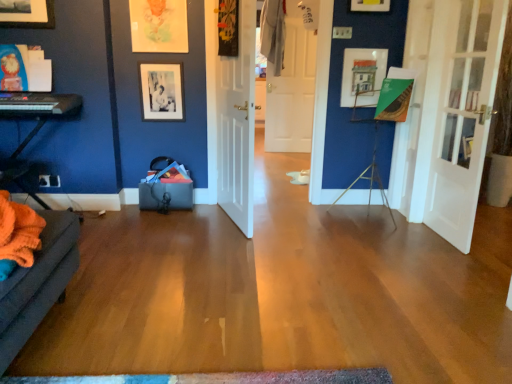
Question: Is white wooden door at center, the third door positioned from the right, next to black matte picture frame at upper center, which is counted as the third picture frame, starting from the right?

Choices:
 (A) yes
 (B) no

Answer: (B)

Question: Considering the relative sizes of white wooden door at center, positioned as the second door in back-to-front order, and black matte picture frame at upper center, marked as the first picture frame in a left-to-right arrangement, in the image provided, is white wooden door at center, positioned as the second door in back-to-front order, wider than black matte picture frame at upper center, marked as the first picture frame in a left-to-right arrangement,?

Choices:
 (A) no
 (B) yes

Answer: (B)

Question: Can you confirm if white wooden door at center, the third door positioned from the right, is bigger than black matte picture frame at upper center, which is counted as the third picture frame, starting from the right?

Choices:
 (A) yes
 (B) no

Answer: (A)

Question: From the image's perspective, is white wooden door at center, the third door positioned from the right, above black matte picture frame at upper center, which is counted as the third picture frame, starting from the right?

Choices:
 (A) yes
 (B) no

Answer: (B)

Question: Is white wooden door at center, the third door positioned from the right, closer to the viewer compared to black matte picture frame at upper center, which is counted as the third picture frame, starting from the right?

Choices:
 (A) no
 (B) yes

Answer: (B)

Question: Would you say black matte picture frame at upper center, which is counted as the third picture frame, starting from the right, is part of white wooden door at center, the third door positioned from the right,'s contents?

Choices:
 (A) no
 (B) yes

Answer: (A)

Question: Is the position of black matte keyboard at left more distant than that of matte wooden picture frame at upper center, marked as the first picture frame in a right-to-left arrangement?

Choices:
 (A) yes
 (B) no

Answer: (B)

Question: Is black matte keyboard at left bigger than matte wooden picture frame at upper center, acting as the third picture frame starting from the left?

Choices:
 (A) yes
 (B) no

Answer: (A)

Question: Is black matte keyboard at left not near matte wooden picture frame at upper center, marked as the first picture frame in a right-to-left arrangement?

Choices:
 (A) yes
 (B) no

Answer: (A)

Question: From a real-world perspective, is black matte keyboard at left over matte wooden picture frame at upper center, marked as the first picture frame in a right-to-left arrangement?

Choices:
 (A) yes
 (B) no

Answer: (B)

Question: Could you tell me if black matte keyboard at left is facing matte wooden picture frame at upper center, marked as the first picture frame in a right-to-left arrangement?

Choices:
 (A) no
 (B) yes

Answer: (A)

Question: From the image's perspective, is black matte keyboard at left below matte wooden picture frame at upper center, marked as the first picture frame in a right-to-left arrangement?

Choices:
 (A) no
 (B) yes

Answer: (B)

Question: Is black matte picture frame at upper center, marked as the first picture frame in a left-to-right arrangement, placed right next to matte paper picture frame at upper center, which is counted as the second picture frame, starting from the left?

Choices:
 (A) yes
 (B) no

Answer: (B)